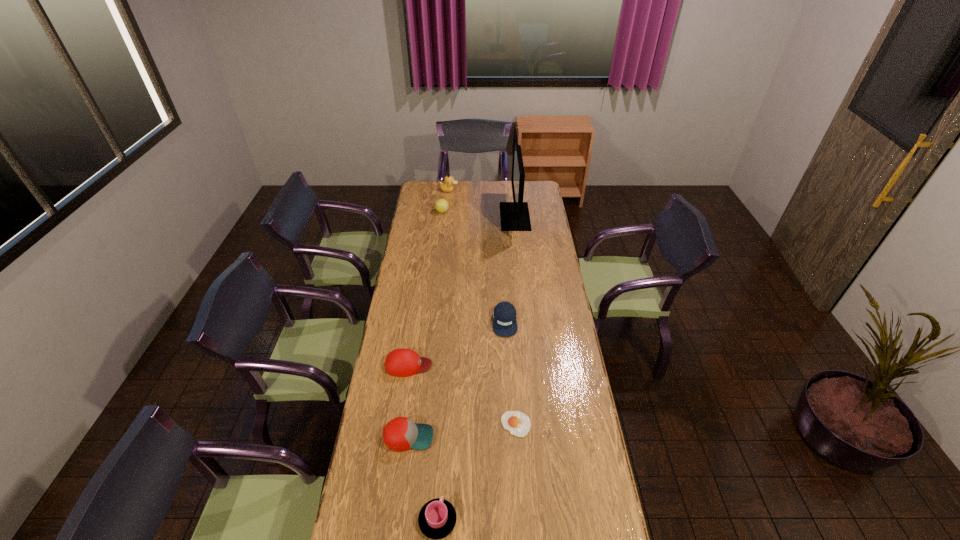
At what (x,y) coordinates should I click in order to perform the action: click on free space located 0.240m on the screen side of the tallest object. Please return your answer as a coordinate pair (x, y). Image resolution: width=960 pixels, height=540 pixels. Looking at the image, I should click on (461, 217).

In order to click on free region located 0.240m on the screen side of the tallest object in this screenshot , I will do `click(461, 217)`.

Locate an element on the screen. This screenshot has width=960, height=540. vacant region located 0.310m on the face of the duckling is located at coordinates (505, 190).

Where is `vacant area situated 0.100m on the left of the tennis ball`? vacant area situated 0.100m on the left of the tennis ball is located at coordinates (420, 212).

I want to click on free space located 0.190m on the front-facing side of the second farthest baseball cap, so [477, 365].

At what (x,y) coordinates should I click in order to perform the action: click on vacant space located 0.280m on the front-facing side of the farthest baseball cap. Please return your answer as a coordinate pair (x, y). The height and width of the screenshot is (540, 960). Looking at the image, I should click on (509, 392).

At what (x,y) coordinates should I click in order to perform the action: click on free region located at the brim of the nearest baseball cap. Please return your answer as a coordinate pair (x, y). Looking at the image, I should click on (469, 437).

The height and width of the screenshot is (540, 960). I want to click on free space located on the front of the egg yolk, so click(x=519, y=485).

At what (x,y) coordinates should I click in order to perform the action: click on monitor located at the far edge. Please return your answer as a coordinate pair (x, y). Image resolution: width=960 pixels, height=540 pixels. Looking at the image, I should click on (514, 216).

This screenshot has width=960, height=540. I want to click on duckling that is at the far edge, so click(447, 186).